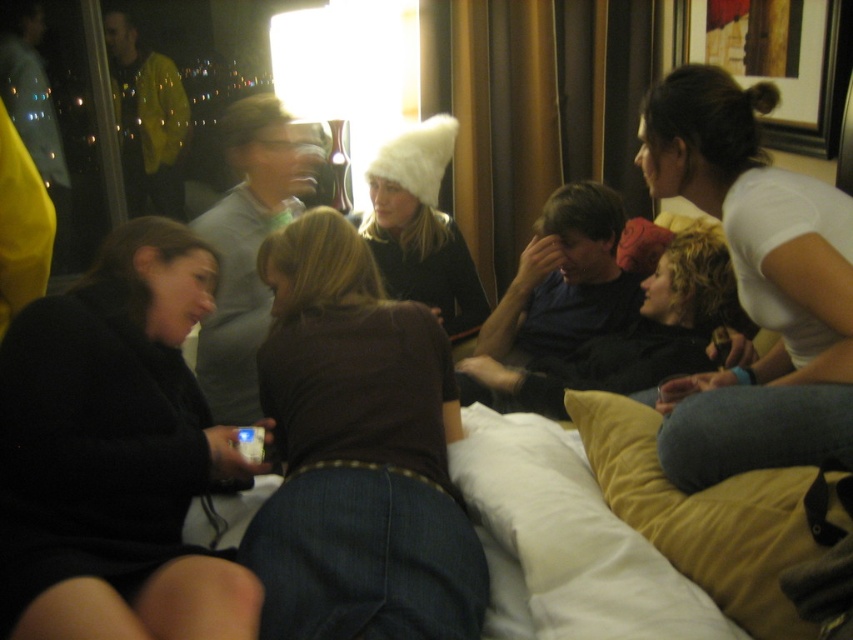
Question: Which of these objects is positioned farthest from the white fuzzy hat at center?

Choices:
 (A) white soft pillow at lower center
 (B) yellow fabric pillow at lower right
 (C) dark brown hair at center
 (D) white matte shirt at upper right

Answer: (B)

Question: Among these objects, which one is farthest from the camera?

Choices:
 (A) yellow fabric pillow at lower right
 (B) white matte shirt at upper right

Answer: (B)

Question: Can you confirm if black matte jacket at lower left is smaller than yellow fabric pillow at lower right?

Choices:
 (A) no
 (B) yes

Answer: (A)

Question: Estimate the real-world distances between objects in this image. Which object is closer to the black matte jacket at lower left?

Choices:
 (A) yellow fabric pillow at lower right
 (B) brown fabric shirt at center
 (C) white soft pillow at lower center
 (D) white matte shirt at upper right

Answer: (B)

Question: Is white soft pillow at lower center positioned behind yellow fabric pillow at lower right?

Choices:
 (A) no
 (B) yes

Answer: (B)

Question: Can you confirm if brown fabric shirt at center is positioned to the right of white matte shirt at upper right?

Choices:
 (A) no
 (B) yes

Answer: (A)